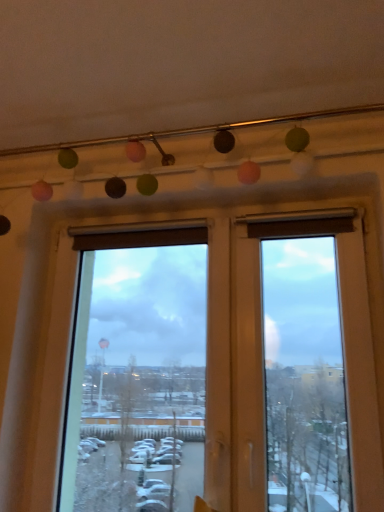
The width and height of the screenshot is (384, 512). Describe the element at coordinates (147, 366) in the screenshot. I see `transparent glass window at center` at that location.

I want to click on transparent glass window at center, so click(147, 366).

This screenshot has height=512, width=384. What are the coordinates of `transparent glass window at center` in the screenshot? It's located at (147, 366).